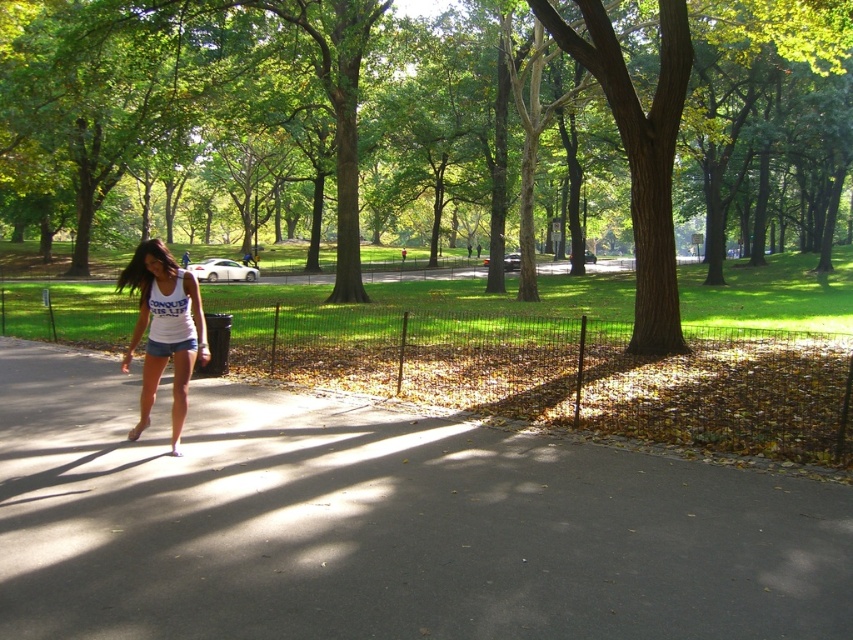
Question: Is brown textured tree at center wider than gray asphalt pavement at center?

Choices:
 (A) yes
 (B) no

Answer: (A)

Question: Can you confirm if brown textured tree at center is positioned to the right of gray asphalt pavement at center?

Choices:
 (A) no
 (B) yes

Answer: (B)

Question: Is brown textured tree at center to the right of gray asphalt pavement at center from the viewer's perspective?

Choices:
 (A) no
 (B) yes

Answer: (B)

Question: Which of the following is the farthest from the observer?

Choices:
 (A) gray asphalt pavement at center
 (B) white cotton tank top at center
 (C) brown textured tree at center

Answer: (C)

Question: Which is nearer to the gray asphalt pavement at center?

Choices:
 (A) white cotton tank top at center
 (B) brown textured tree at center

Answer: (A)

Question: Which of these objects is positioned closest to the gray asphalt pavement at center?

Choices:
 (A) white cotton tank top at center
 (B) brown textured tree at center

Answer: (A)